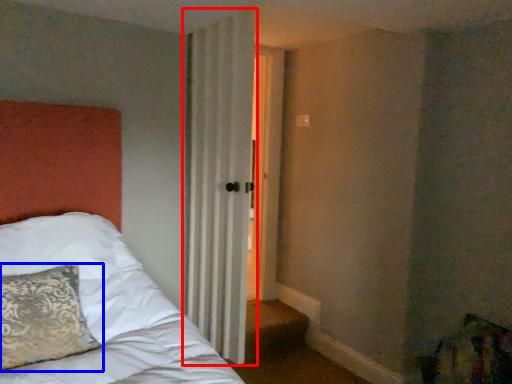
Question: Which object appears farthest to the camera in this image, curtain (highlighted by a red box) or pillow (highlighted by a blue box)?

Choices:
 (A) curtain
 (B) pillow

Answer: (A)